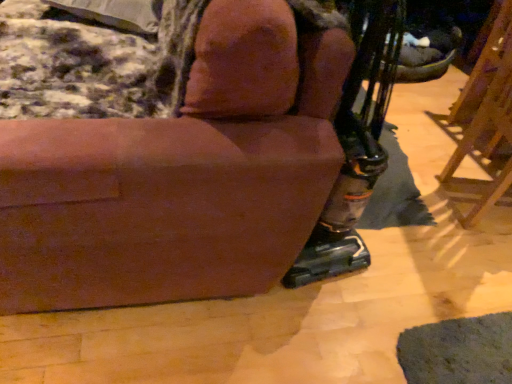
Locate an element on the screen. brown wood easel at right is located at coordinates (484, 127).

The image size is (512, 384). Describe the element at coordinates (116, 13) in the screenshot. I see `velvety gray pillow at upper left` at that location.

Where is `brown fabric chair at center`? brown fabric chair at center is located at coordinates (180, 176).

In the image, is velvety gray pillow at upper left positioned in front of or behind brown fabric chair at center?

Clearly, velvety gray pillow at upper left is behind brown fabric chair at center.

Is velvety gray pillow at upper left bigger than brown fabric chair at center?

No.

Based on the photo, could you tell me if velvety gray pillow at upper left is turned towards brown fabric chair at center?

Yes, velvety gray pillow at upper left faces towards brown fabric chair at center.

Considering the relative sizes of velvety gray pillow at upper left and brown fabric chair at center in the image provided, is velvety gray pillow at upper left thinner than brown fabric chair at center?

Indeed, velvety gray pillow at upper left has a lesser width compared to brown fabric chair at center.

Is brown fabric chair at center completely or partially outside of velvety gray pillow at upper left?

brown fabric chair at center lies outside velvety gray pillow at upper left's area.

Measure the distance from brown fabric chair at center to velvety gray pillow at upper left.

brown fabric chair at center is 32.35 inches away from velvety gray pillow at upper left.

The width and height of the screenshot is (512, 384). Find the location of `pillow located above the brown fabric chair at center (from the image's perspective)`. pillow located above the brown fabric chair at center (from the image's perspective) is located at coordinates (116, 13).

Is brown fabric chair at center not close to velvety gray pillow at upper left?

They are positioned close to each other.

Could you tell me if brown fabric chair at center is turned towards brown wood easel at right?

No, brown fabric chair at center is not turned towards brown wood easel at right.

Is point (240, 172) farther from camera compared to point (490, 99)?

No, it is not.

Is brown fabric chair at center touching brown wood easel at right?

No, brown fabric chair at center is not beside brown wood easel at right.

Is brown fabric chair at center to the left or to the right of brown wood easel at right in the image?

From the image, it's evident that brown fabric chair at center is to the left of brown wood easel at right.

Is point (510, 13) positioned behind point (139, 2)?

Yes, it is.

From the image's perspective, relative to velvety gray pillow at upper left, is brown wood easel at right above or below?

Based on their image positions, brown wood easel at right is located beneath velvety gray pillow at upper left.

Between brown wood easel at right and velvety gray pillow at upper left, which one appears on the left side from the viewer's perspective?

Positioned to the left is velvety gray pillow at upper left.

Is brown wood easel at right taller than velvety gray pillow at upper left?

Indeed, brown wood easel at right has a greater height compared to velvety gray pillow at upper left.

Is velvety gray pillow at upper left oriented away from brown wood easel at right?

Absolutely, velvety gray pillow at upper left is directed away from brown wood easel at right.

Which is closer, (53, 4) or (501, 177)?

Point (53, 4) appears to be closer to the viewer than point (501, 177).

From the image's perspective, which object appears higher, velvety gray pillow at upper left or brown wood easel at right?

velvety gray pillow at upper left appears higher in the image.

Which is in front, velvety gray pillow at upper left or brown wood easel at right?

brown wood easel at right.

Which object is wider, brown wood easel at right or brown fabric chair at center?

brown fabric chair at center is wider.

Who is bigger, brown wood easel at right or brown fabric chair at center?

With larger size is brown fabric chair at center.

Is brown wood easel at right shorter than brown fabric chair at center?

Indeed, brown wood easel at right has a lesser height compared to brown fabric chair at center.

Find the location of a particular element. The image size is (512, 384). pillow that is above the brown fabric chair at center (from a real-world perspective) is located at coordinates (116, 13).

Where is `pillow on the left of brown fabric chair at center`? pillow on the left of brown fabric chair at center is located at coordinates [116, 13].

Which object lies further to the anchor point brown wood easel at right, brown fabric chair at center or velvety gray pillow at upper left?

velvety gray pillow at upper left.

From the picture: When comparing their distances from brown wood easel at right, does velvety gray pillow at upper left or brown fabric chair at center seem further?

Based on the image, velvety gray pillow at upper left appears to be further to brown wood easel at right.

Considering their positions, is brown wood easel at right positioned closer to brown fabric chair at center than velvety gray pillow at upper left?

velvety gray pillow at upper left is positioned closer to the anchor brown fabric chair at center.

Considering their positions, is brown fabric chair at center positioned further to velvety gray pillow at upper left than brown wood easel at right?

Based on the image, brown wood easel at right appears to be further to velvety gray pillow at upper left.

Based on their spatial positions, is velvety gray pillow at upper left or brown wood easel at right further from brown fabric chair at center?

brown wood easel at right is positioned further to the anchor brown fabric chair at center.

When comparing their distances from velvety gray pillow at upper left, does brown wood easel at right or brown fabric chair at center seem closer?

brown fabric chair at center lies closer to velvety gray pillow at upper left than the other object.

At what (x,y) coordinates should I click in order to perform the action: click on chair between velvety gray pillow at upper left and brown wood easel at right in the horizontal direction. Please return your answer as a coordinate pair (x, y). The width and height of the screenshot is (512, 384). Looking at the image, I should click on (180, 176).